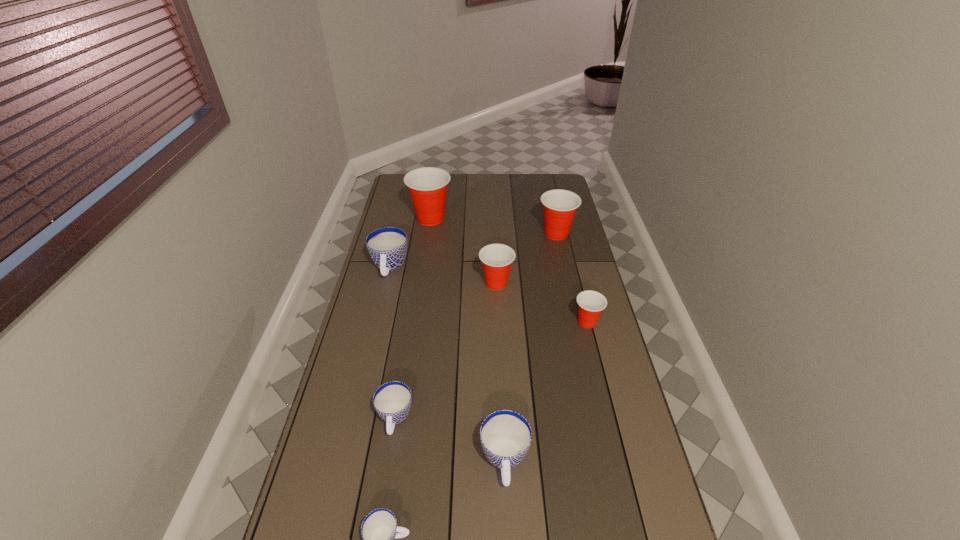
What are the coordinates of `free space at the left edge of the desktop` in the screenshot? It's located at (396, 338).

The width and height of the screenshot is (960, 540). Find the location of `vacant space at the right edge of the desktop`. vacant space at the right edge of the desktop is located at coordinates (596, 328).

Find the location of a particular element. This screenshot has width=960, height=540. free space at the far right corner of the desktop is located at coordinates (538, 191).

The width and height of the screenshot is (960, 540). Find the location of `vacant region between the leftmost red cup and the farthest blue cup`. vacant region between the leftmost red cup and the farthest blue cup is located at coordinates (410, 243).

You are a GUI agent. You are given a task and a screenshot of the screen. Output one action in this format:
    pyautogui.click(x=<x>, y=<y>)
    Task: Click on the empty space between the third smallest blue cup and the third biggest blue cup
    The height and width of the screenshot is (540, 960).
    Given the screenshot: What is the action you would take?
    pos(450,440)

You are a GUI agent. You are given a task and a screenshot of the screen. Output one action in this format:
    pyautogui.click(x=<x>, y=<y>)
    Task: Click on the free spot between the second tallest object and the biggest blue cup
    This screenshot has height=540, width=960.
    Given the screenshot: What is the action you would take?
    pyautogui.click(x=473, y=251)

I want to click on empty location between the seventh tallest cup and the second tallest cup, so click(475, 326).

You are a GUI agent. You are given a task and a screenshot of the screen. Output one action in this format:
    pyautogui.click(x=<x>, y=<y>)
    Task: Click on the free space between the biggest blue cup and the second shortest object
    
    Given the screenshot: What is the action you would take?
    pyautogui.click(x=393, y=343)

I want to click on free spot between the tallest object and the rightmost blue cup, so click(468, 340).

Where is `free space between the biggest blue cup and the tallest cup`? The height and width of the screenshot is (540, 960). free space between the biggest blue cup and the tallest cup is located at coordinates (410, 243).